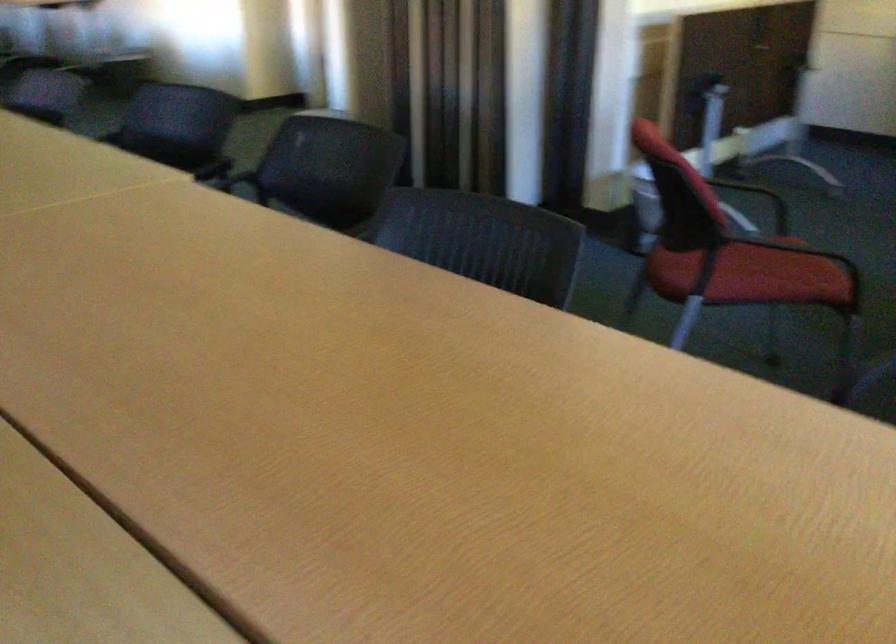
The width and height of the screenshot is (896, 644). Find the location of `red chair sitting surface`. red chair sitting surface is located at coordinates pos(778,272).